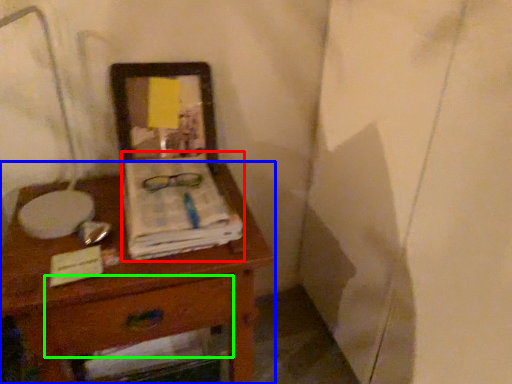
Question: Estimate the real-world distances between objects in this image. Which object is farther from magazine (highlighted by a red box), desk (highlighted by a blue box) or drawer (highlighted by a green box)?

Choices:
 (A) desk
 (B) drawer

Answer: (B)